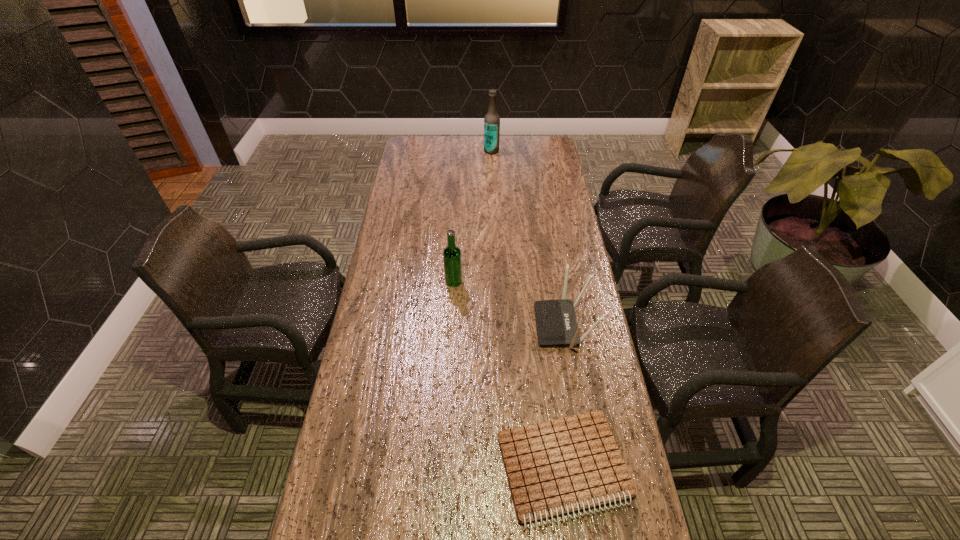
Locate an element on the screen. vacant area situated on the side of the farthest object with the label is located at coordinates (406, 151).

You are a GUI agent. You are given a task and a screenshot of the screen. Output one action in this format:
    pyautogui.click(x=<x>, y=<y>)
    Task: Click on the free space located on the front of the left beer bottle
    This screenshot has height=540, width=960.
    Given the screenshot: What is the action you would take?
    pyautogui.click(x=452, y=303)

Where is `free space located 0.390m on the front-facing side of the second shortest object`? The image size is (960, 540). free space located 0.390m on the front-facing side of the second shortest object is located at coordinates (414, 325).

Locate an element on the screen. The width and height of the screenshot is (960, 540). vacant space located on the front-facing side of the second shortest object is located at coordinates (423, 325).

Locate an element on the screen. This screenshot has height=540, width=960. free location located on the front-facing side of the second shortest object is located at coordinates (448, 325).

Identify the location of vacant space located 0.200m on the left of the notebook. (419, 468).

Find the location of a particular element. object that is at the far edge is located at coordinates (492, 120).

Where is `router located at the right edge`? The image size is (960, 540). router located at the right edge is located at coordinates (556, 322).

Image resolution: width=960 pixels, height=540 pixels. I want to click on notebook that is at the right edge, so click(x=572, y=463).

Image resolution: width=960 pixels, height=540 pixels. Identify the location of vacant space at the left edge of the desktop. (386, 298).